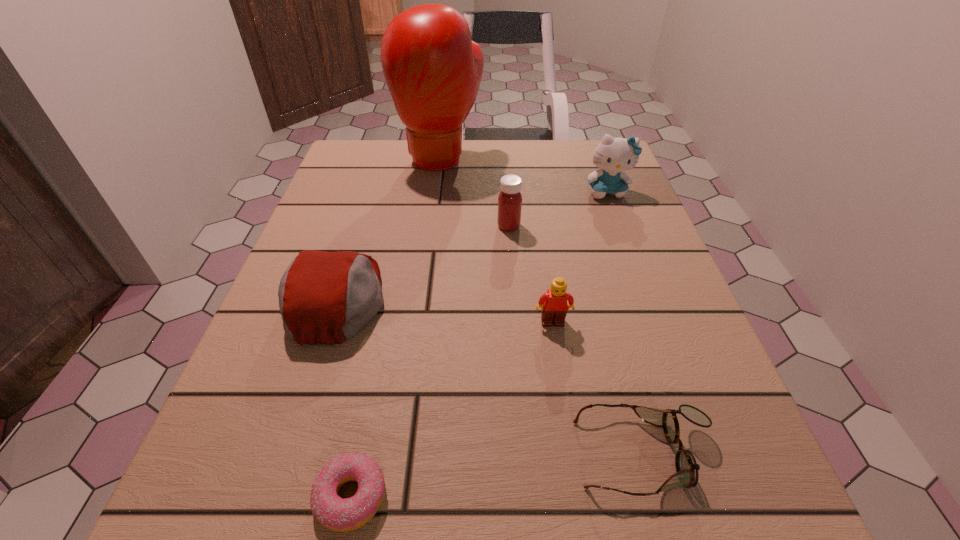
You are a GUI agent. You are given a task and a screenshot of the screen. Output one action in this format:
    pyautogui.click(x=<x>, y=<y>)
    Task: Click on the boxing glove
    This screenshot has height=540, width=960.
    Given the screenshot: What is the action you would take?
    pyautogui.click(x=433, y=69)

Identify the location of the farthest object. (433, 69).

The height and width of the screenshot is (540, 960). In order to click on the sixth shortest object in this screenshot , I will do `click(613, 155)`.

Identify the location of the second farthest object. This screenshot has width=960, height=540. (613, 155).

I want to click on the third farthest object, so click(510, 199).

The height and width of the screenshot is (540, 960). Identify the location of the fourth object from right to left. (510, 199).

Where is `cap`? cap is located at coordinates (325, 297).

Image resolution: width=960 pixels, height=540 pixels. I want to click on Lego, so click(x=553, y=304).

Where is `the second shortest object`? Image resolution: width=960 pixels, height=540 pixels. the second shortest object is located at coordinates (687, 469).

The image size is (960, 540). What are the coordinates of `doughnut` in the screenshot? It's located at (337, 514).